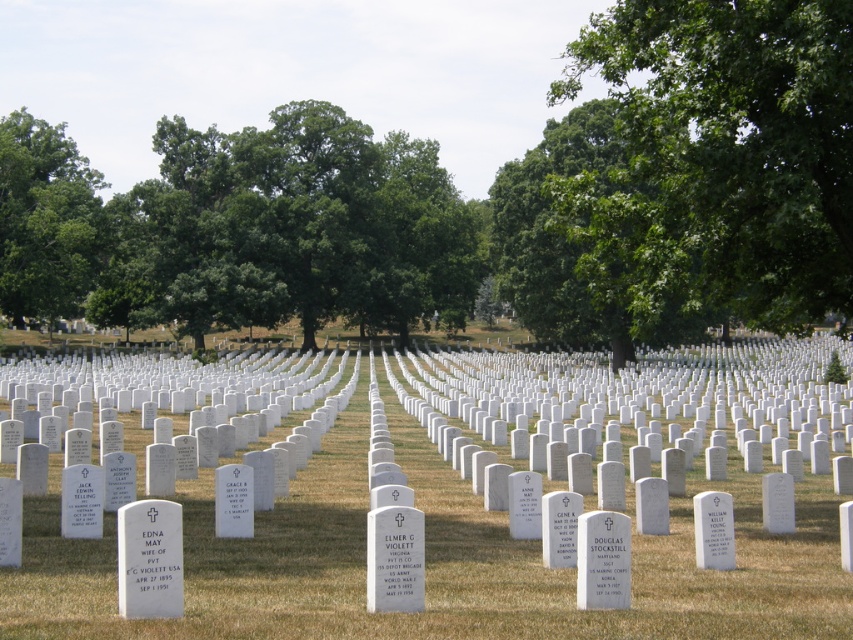
Is point (846, 164) farther from viewer compared to point (16, 115)?

No, (846, 164) is closer to viewer.

Does point (711, 28) lie in front of point (26, 202)?

That is True.

At what (x,y) coordinates should I click in order to perform the action: click on green leafy tree at upper right. Please return your answer as a coordinate pair (x, y). Looking at the image, I should click on (718, 163).

Is green grass at center bigger than green leafy tree at upper left?

Indeed, green grass at center has a larger size compared to green leafy tree at upper left.

Between point (727, 612) and point (86, 282), which one is positioned behind?

The point (86, 282) is more distant.

Who is more forward, (550,630) or (51,257)?

Point (550,630)

At what (x,y) coordinates should I click in order to perform the action: click on green grass at center. Please return your answer as a coordinate pair (x, y). Image resolution: width=853 pixels, height=640 pixels. Looking at the image, I should click on [x=437, y=556].

Is point (640, 540) behind point (693, 188)?

No, (640, 540) is in front of (693, 188).

Is point (593, 499) farther from viewer compared to point (691, 90)?

Yes, point (593, 499) is farther from viewer.

Where is `green grass at center`? green grass at center is located at coordinates (437, 556).